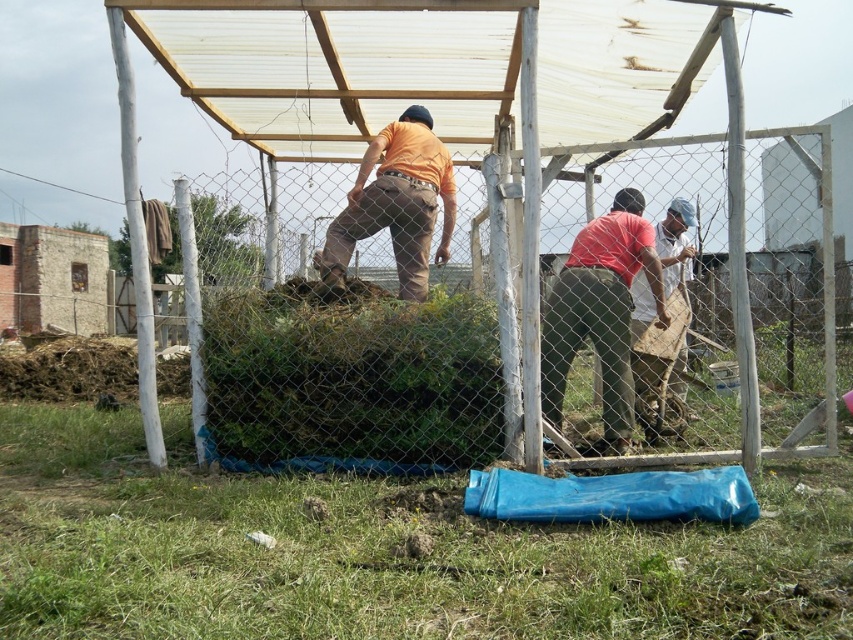
Question: Does wire mesh fence at center have a lesser width compared to white woven basket at center?

Choices:
 (A) no
 (B) yes

Answer: (B)

Question: Which object is the farthest from the transparent plastic canopy at upper center?

Choices:
 (A) matte pink shirt at center
 (B) wire mesh fence at center
 (C) orange matte shirt at center
 (D) white woven basket at center

Answer: (B)

Question: Which object appears closest to the camera in this image?

Choices:
 (A) orange matte shirt at center
 (B) transparent plastic canopy at upper center
 (C) wire mesh fence at center
 (D) matte pink shirt at center

Answer: (B)

Question: Which of the following is the closest to the observer?

Choices:
 (A) orange matte shirt at center
 (B) wire mesh fence at center

Answer: (A)

Question: Can you confirm if wire mesh fence at center is positioned above white woven basket at center?

Choices:
 (A) yes
 (B) no

Answer: (B)

Question: Does transparent plastic canopy at upper center appear over orange matte shirt at center?

Choices:
 (A) yes
 (B) no

Answer: (A)